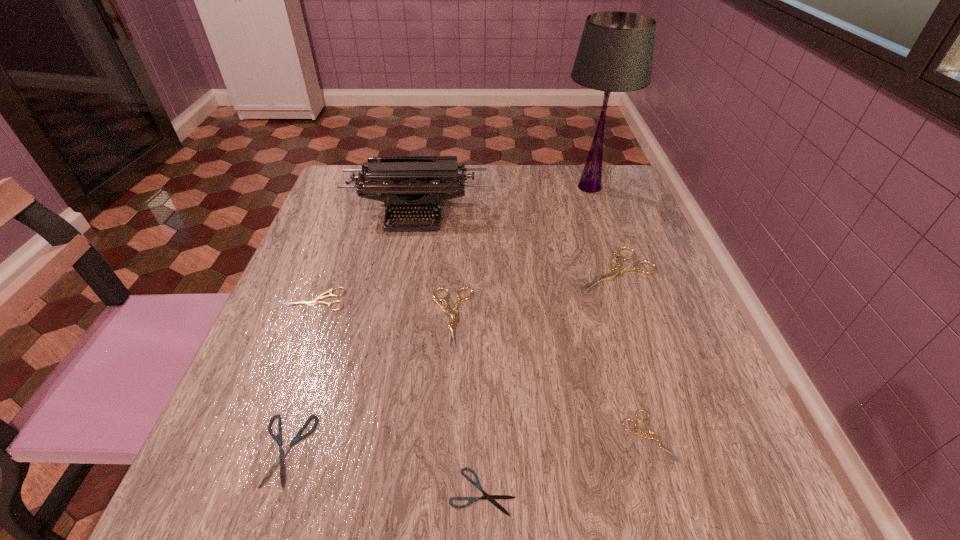
The height and width of the screenshot is (540, 960). Find the location of `lampshade that is at the far edge`. lampshade that is at the far edge is located at coordinates (615, 54).

Image resolution: width=960 pixels, height=540 pixels. I want to click on typewriter at the far edge, so click(x=388, y=179).

Image resolution: width=960 pixels, height=540 pixels. Identify the location of typewriter positioned at the left edge. (388, 179).

Identify the location of lampshade that is at the right edge. (615, 54).

The width and height of the screenshot is (960, 540). Identify the location of object located at the far left corner. (388, 179).

The height and width of the screenshot is (540, 960). What are the coordinates of `object present at the near left corner` in the screenshot? It's located at (282, 452).

Find the location of a particular element. Image resolution: width=960 pixels, height=540 pixels. object present at the far right corner is located at coordinates (615, 54).

I want to click on object present at the near right corner, so click(651, 435).

Where is `free space at the far edge`? This screenshot has height=540, width=960. free space at the far edge is located at coordinates (477, 191).

Where is `vacant space at the near edge of the desktop`? The image size is (960, 540). vacant space at the near edge of the desktop is located at coordinates (380, 482).